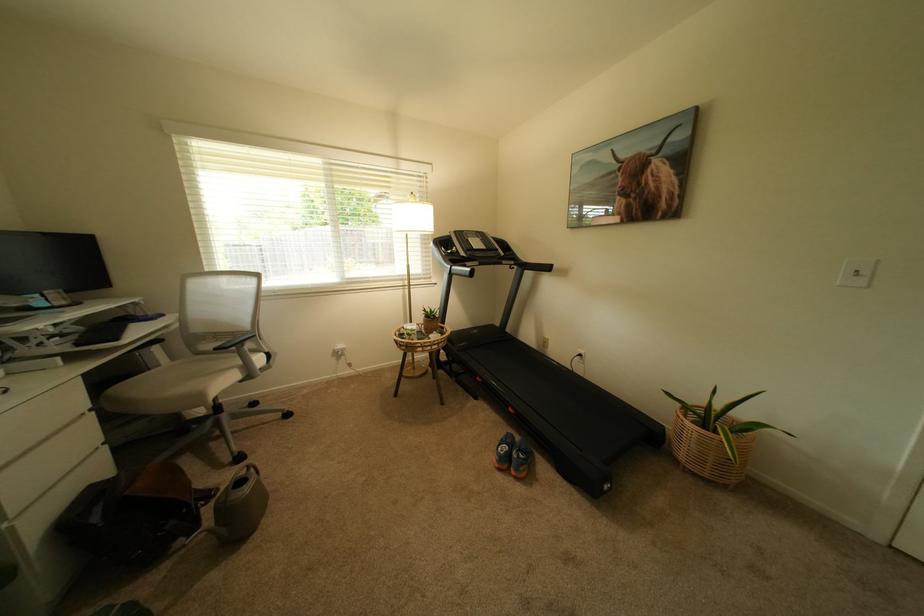
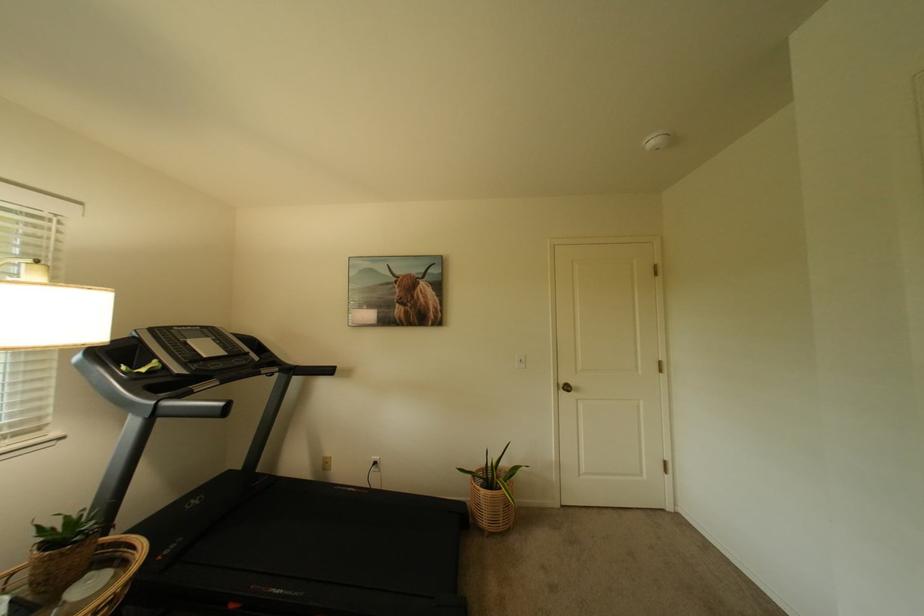
The point at [695,448] is marked in the first image. Where is the corresponding point in the second image?

(495, 515)